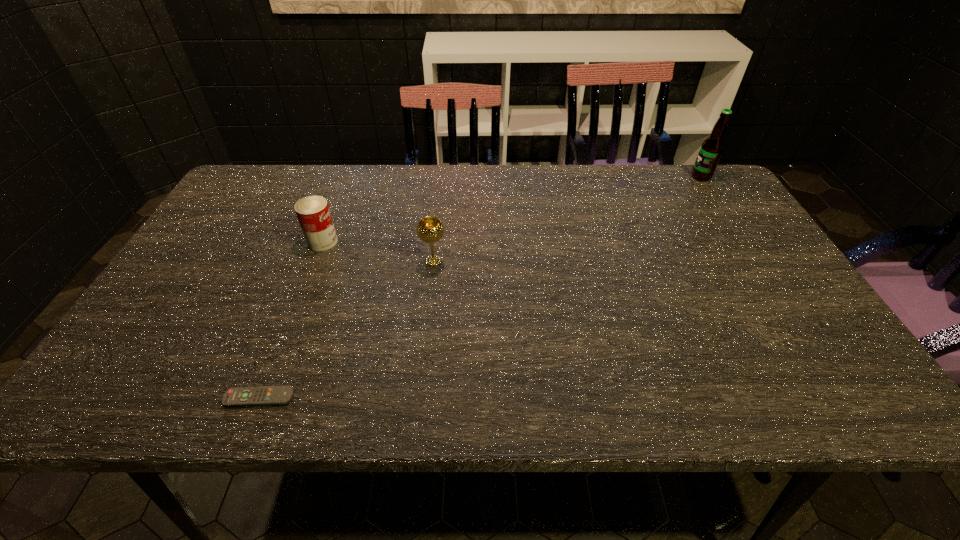
The height and width of the screenshot is (540, 960). What are the coordinates of `the rightmost object` in the screenshot? It's located at (712, 147).

At what (x,y) coordinates should I click in order to perform the action: click on the tallest object. Please return your answer as a coordinate pair (x, y). The width and height of the screenshot is (960, 540). Looking at the image, I should click on (712, 147).

The height and width of the screenshot is (540, 960). I want to click on the second nearest object, so click(x=430, y=229).

Locate an element on the screen. The height and width of the screenshot is (540, 960). the third object from left to right is located at coordinates (430, 229).

This screenshot has height=540, width=960. I want to click on can, so click(x=313, y=213).

The image size is (960, 540). In order to click on the shortest object in this screenshot , I will do (x=264, y=395).

Locate an element on the screen. remote control is located at coordinates (264, 395).

Where is `free space located on the label of the rightmost object`? This screenshot has height=540, width=960. free space located on the label of the rightmost object is located at coordinates (601, 177).

Image resolution: width=960 pixels, height=540 pixels. I want to click on vacant space located on the label of the rightmost object, so click(569, 177).

Locate an element on the screen. The image size is (960, 540). vacant space located 0.310m on the label of the rightmost object is located at coordinates (594, 177).